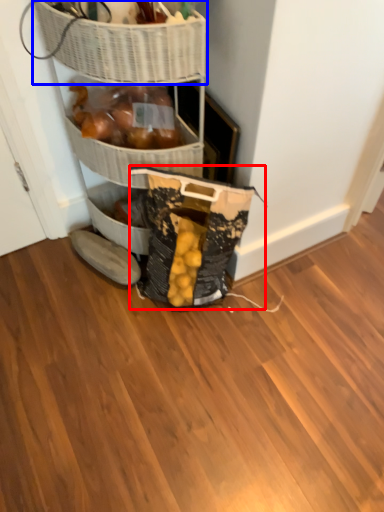
Question: Which of the following is the closest to the observer, material (highlighted by a red box) or basket (highlighted by a blue box)?

Choices:
 (A) material
 (B) basket

Answer: (B)